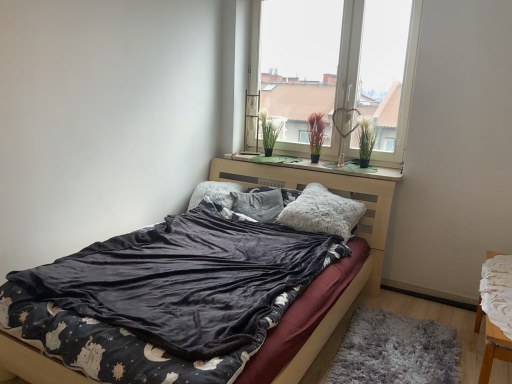
Question: Considering the relative positions of fluffy gray pillow at center, which is counted as the second pillow, starting from the left, and green felt at center in the image provided, is fluffy gray pillow at center, which is counted as the second pillow, starting from the left, in front of green felt at center?

Choices:
 (A) yes
 (B) no

Answer: (B)

Question: Is fluffy gray pillow at center, which is counted as the second pillow, starting from the left, to the left of green felt at center from the viewer's perspective?

Choices:
 (A) no
 (B) yes

Answer: (B)

Question: Is green felt at center a part of fluffy gray pillow at center, the 2th pillow viewed from the right?

Choices:
 (A) no
 (B) yes

Answer: (A)

Question: From a real-world perspective, is fluffy gray pillow at center, which is counted as the second pillow, starting from the left, under green felt at center?

Choices:
 (A) yes
 (B) no

Answer: (A)

Question: Is fluffy gray pillow at center, which is counted as the second pillow, starting from the left, looking in the opposite direction of green felt at center?

Choices:
 (A) yes
 (B) no

Answer: (B)

Question: From the image's perspective, relative to white lace chair at lower right, is green felt at center above or below?

Choices:
 (A) below
 (B) above

Answer: (B)

Question: From a real-world perspective, is green felt at center physically located above or below white lace chair at lower right?

Choices:
 (A) above
 (B) below

Answer: (A)

Question: Is point (267, 162) positioned closer to the camera than point (484, 380)?

Choices:
 (A) farther
 (B) closer

Answer: (A)

Question: Is green felt at center taller or shorter than white lace chair at lower right?

Choices:
 (A) tall
 (B) short

Answer: (B)

Question: Is point (480, 379) positioned closer to the camera than point (321, 115)?

Choices:
 (A) farther
 (B) closer

Answer: (B)

Question: Is white lace chair at lower right inside the boundaries of burgundy matte plant at center, placed as the second plant when sorted from left to right, or outside?

Choices:
 (A) inside
 (B) outside

Answer: (B)

Question: From a real-world perspective, is white lace chair at lower right above or below burgundy matte plant at center, placed as the second plant when sorted from left to right?

Choices:
 (A) below
 (B) above

Answer: (A)

Question: Based on their positions, is white lace chair at lower right located to the left or right of burgundy matte plant at center, placed as the second plant when sorted from left to right?

Choices:
 (A) left
 (B) right

Answer: (B)

Question: Based on their sizes in the image, would you say transparent glass window at upper center is bigger or smaller than green felt at center?

Choices:
 (A) big
 (B) small

Answer: (A)

Question: Considering the positions of transparent glass window at upper center and green felt at center in the image, is transparent glass window at upper center wider or thinner than green felt at center?

Choices:
 (A) wide
 (B) thin

Answer: (B)